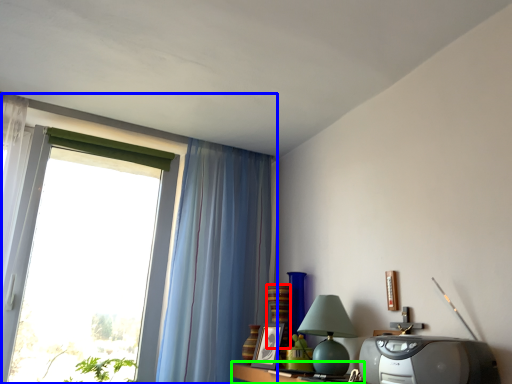
Question: Estimate the real-world distances between objects in this image. Which object is farther from vase (highlighted by a red box), window (highlighted by a blue box) or table (highlighted by a green box)?

Choices:
 (A) window
 (B) table

Answer: (A)